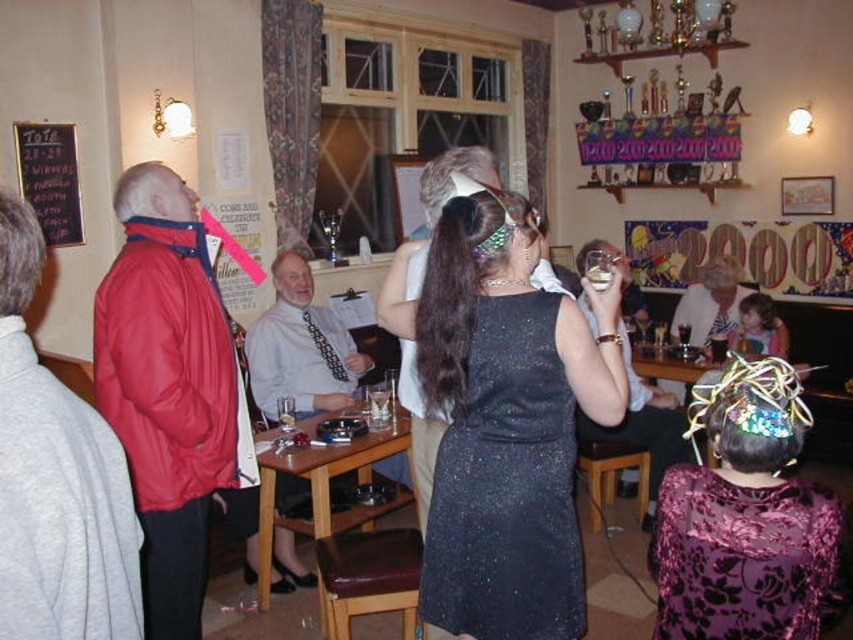
You are a photographer at the event and need to ensure both the sparkly purple dress at center and the translucent glass at upper center are in focus. Which object should you focus on first to ensure depth of field captures both?

The sparkly purple dress at center is taller than the translucent glass at upper center. Since it is taller, focusing on the sparkly purple dress at center first will help ensure the translucent glass at upper center remains within the depth of field range.

You are a guest at the party and want to sit down. You see a leather cushioned stool at lower center and a brown wooden stool at lower center. Which stool is narrower?

The leather cushioned stool at lower center is narrower than the brown wooden stool at lower center.